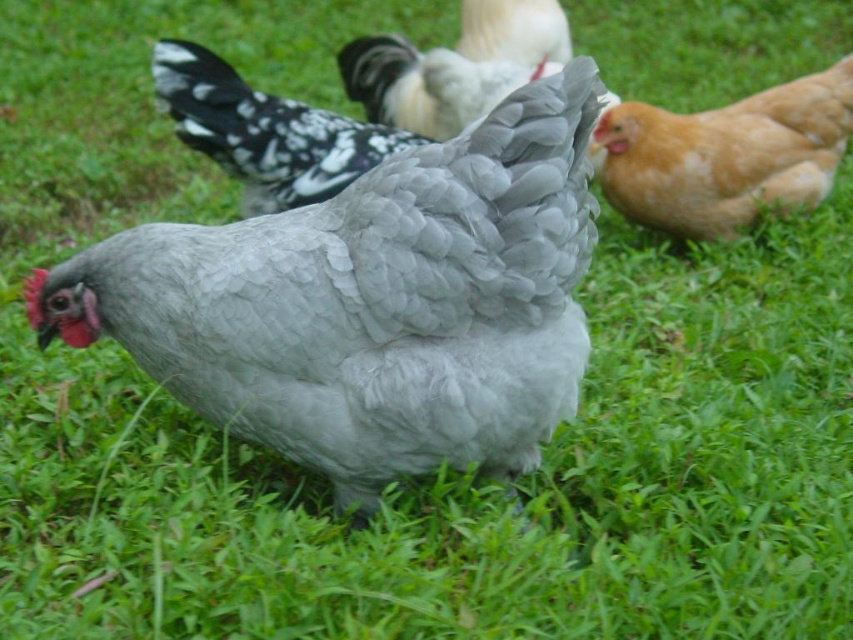
Question: Can you confirm if golden feathered chicken at right is wider than white speckled feathers at center?

Choices:
 (A) yes
 (B) no

Answer: (A)

Question: Which point is farther from the camera taking this photo?

Choices:
 (A) (558, 212)
 (B) (550, 0)

Answer: (B)

Question: Among these objects, which one is nearest to the camera?

Choices:
 (A) white speckled feathers at center
 (B) gray feathered chicken at center
 (C) silvery-gray feathered chicken at center

Answer: (B)

Question: Which of the following is the closest to the observer?

Choices:
 (A) silvery-gray feathered chicken at center
 (B) gray feathered chicken at center
 (C) golden feathered chicken at right
 (D) white speckled feathers at center

Answer: (B)

Question: Is gray feathered chicken at center positioned at the back of golden feathered chicken at right?

Choices:
 (A) no
 (B) yes

Answer: (A)

Question: Is gray feathered chicken at center in front of golden feathered chicken at right?

Choices:
 (A) yes
 (B) no

Answer: (A)